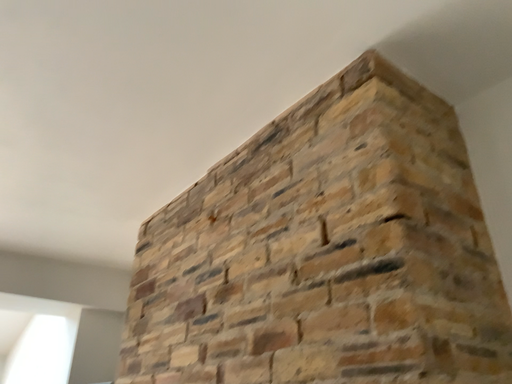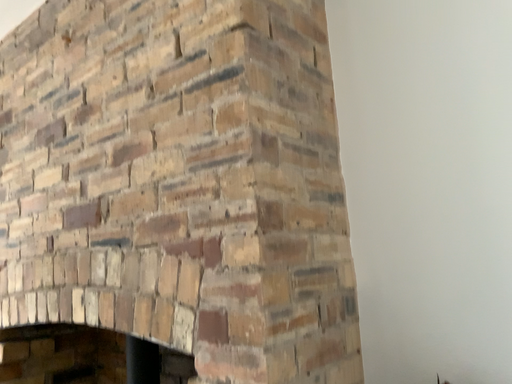
Question: How did the camera likely rotate when shooting the video?

Choices:
 (A) rotated left
 (B) rotated right

Answer: (B)